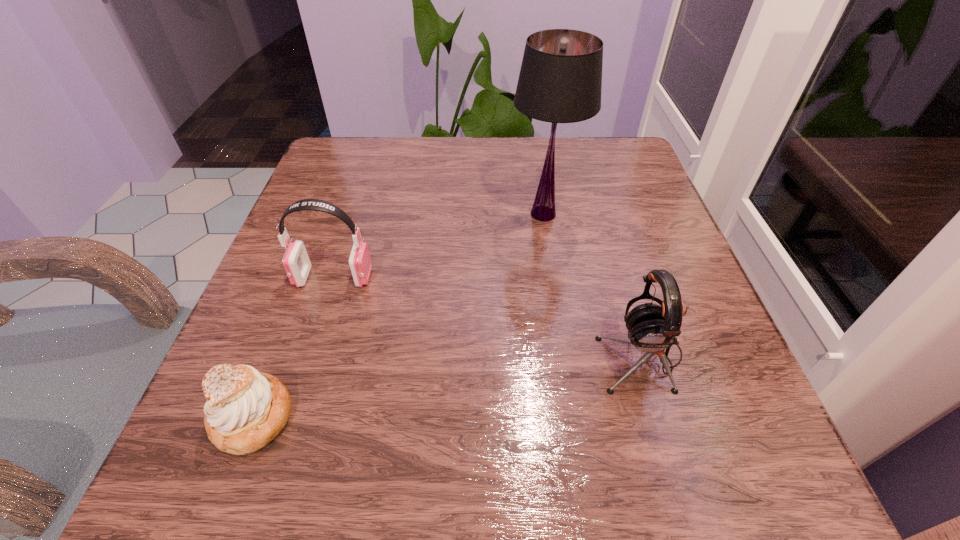
This screenshot has width=960, height=540. In order to click on free spot that satisfies the following two spatial constraints: 1. on the outer surface of the right earphone; 2. on the right side of the left earphone in this screenshot , I will do `click(309, 356)`.

Locate an element on the screen. This screenshot has height=540, width=960. vacant space that satisfies the following two spatial constraints: 1. on the front-facing side of the tallest object; 2. on the back side of the nearer earphone is located at coordinates (565, 356).

The width and height of the screenshot is (960, 540). Identify the location of vacant position in the image that satisfies the following two spatial constraints: 1. on the back side of the shortest object; 2. on the left side of the right earphone. (276, 356).